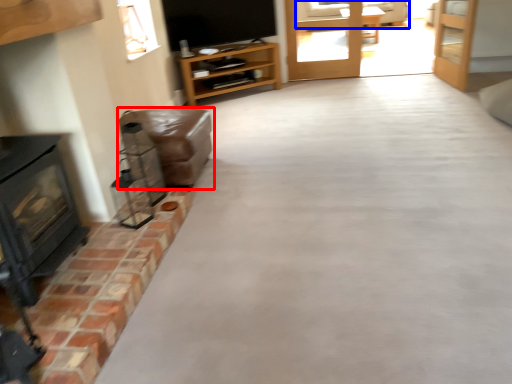
Question: Which object is further to the camera taking this photo, furniture (highlighted by a red box) or couch (highlighted by a blue box)?

Choices:
 (A) furniture
 (B) couch

Answer: (B)